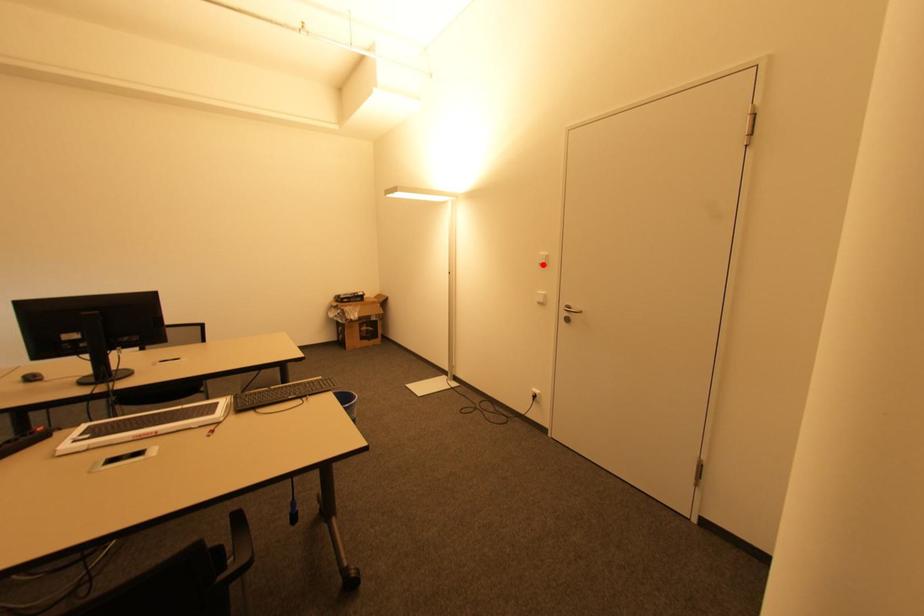
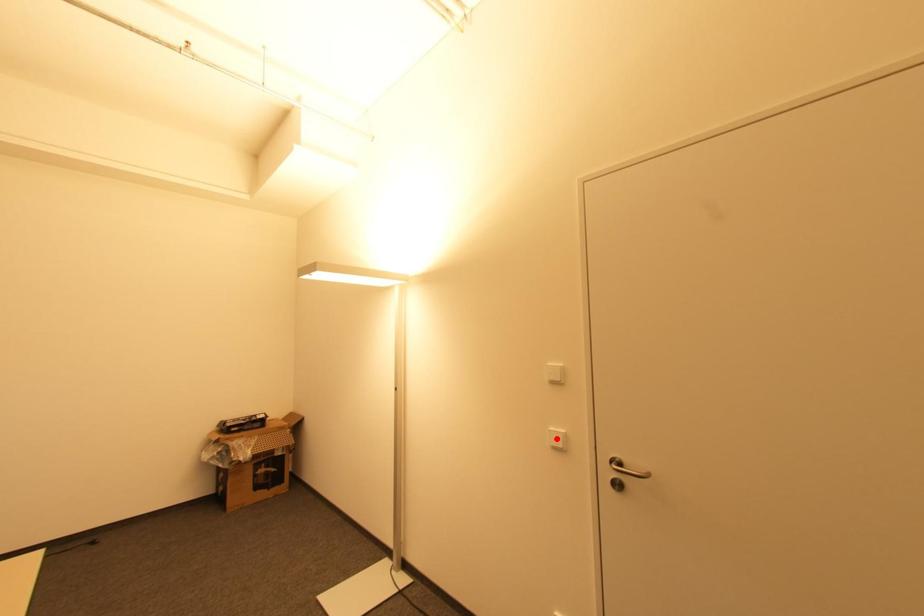
I am providing you with two images of the same scene from different viewpoints. A red point is marked on the first image and another point is marked on the second image. Is the marked point in image1 the same physical position as the marked point in image2?

No